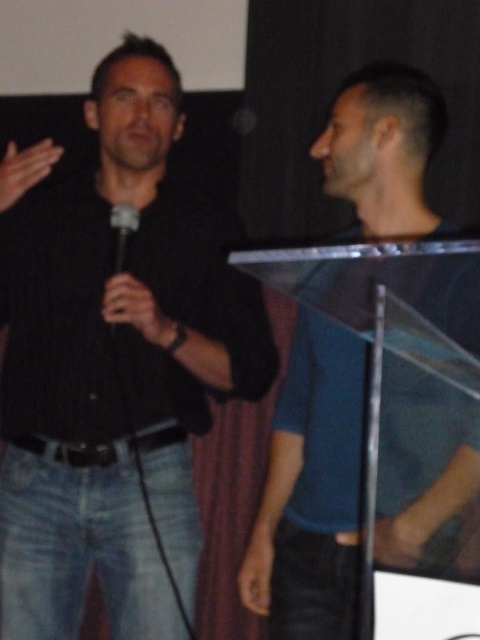
Can you confirm if blue matte shirt at center is positioned to the left of black plastic microphone at center?

No, blue matte shirt at center is not to the left of black plastic microphone at center.

The width and height of the screenshot is (480, 640). Describe the element at coordinates (383, 148) in the screenshot. I see `blue matte shirt at center` at that location.

Where is `blue matte shirt at center`? The height and width of the screenshot is (640, 480). blue matte shirt at center is located at coordinates (383, 148).

Can you confirm if black matte shirt at left is positioned to the left of black plastic microphone at center?

In fact, black matte shirt at left is to the right of black plastic microphone at center.

Which is more to the right, black matte shirt at left or black plastic microphone at center?

black matte shirt at left

The image size is (480, 640). In order to click on black matte shirt at left in this screenshot , I will do `click(112, 368)`.

Does black matte shirt at left have a smaller size compared to blue matte shirt at center?

Incorrect, black matte shirt at left is not smaller in size than blue matte shirt at center.

Does black matte shirt at left appear under blue matte shirt at center?

Yes, black matte shirt at left is below blue matte shirt at center.

Is point (107, 605) positioned behind point (362, 202)?

Yes.

Find the location of a particular element. black matte shirt at left is located at coordinates (112, 368).